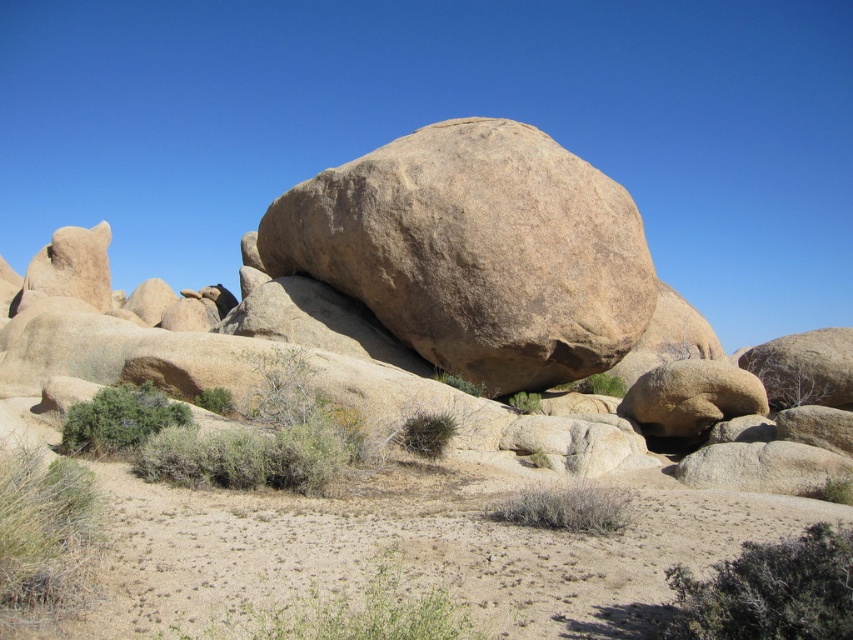
You are a geologist examining the desert landscape. You notice the smooth beige rock at center and the brown rough boulder at center. Which of these two rocks is bigger?

The smooth beige rock at center is larger in size than the brown rough boulder at center.

You are a geologist examining the desert landscape. You notice the smooth beige rock at center and the brown rough boulder at center. Which rock is located below the other?

The smooth beige rock at center is positioned under the brown rough boulder at center.

You are standing in the desert and see the smooth beige rock at center and the brown rough boulder at center. Which one appears nearer to you?

The smooth beige rock at center appears nearer because it is closer to the viewer than the brown rough boulder at center.